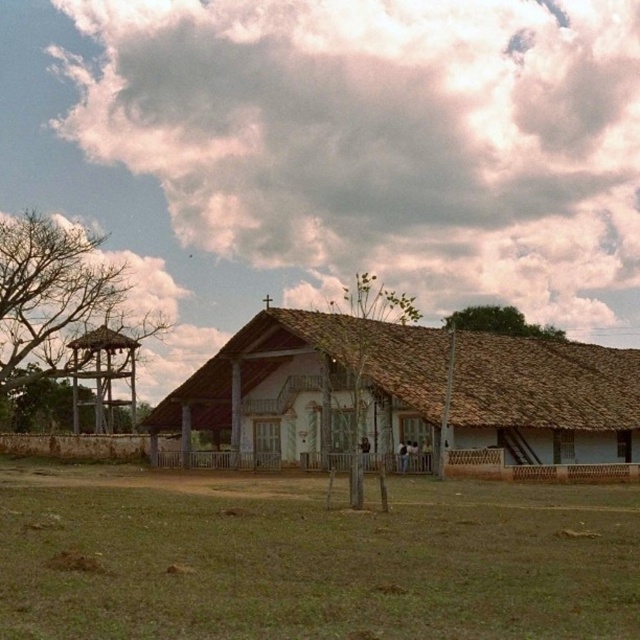
In the scene shown: You are standing in front of the rustic building and want to walk towards the wooden lattice gazebo at left. Which direction should you walk to reach it first, considering the green grass at center is between you and the gazebo?

Since the green grass at center is closer to the viewer than the wooden lattice gazebo at left, you should walk towards the left to reach the wooden lattice gazebo at left first.